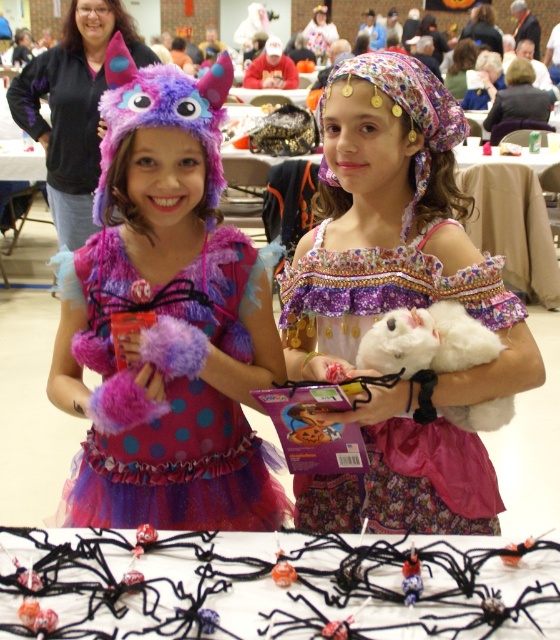
Does point (286, 550) come farther from viewer compared to point (96, 147)?

No, (286, 550) is closer to viewer.

Who is taller, black fabric spider web at lower center or fuzzy purple monster hat at left?

fuzzy purple monster hat at left

Which is behind, point (81, 531) or point (87, 141)?

The point (87, 141) is more distant.

In order to click on black fabric spider web at lower center in this screenshot , I will do `click(274, 586)`.

Is point (494, 524) behind point (440, 314)?

Yes, it is behind point (440, 314).

Find the location of a particular element. The width and height of the screenshot is (560, 640). floral satin dress at center is located at coordinates (407, 483).

Is point (88, 540) in front of point (351, 330)?

Yes, it is in front of point (351, 330).

Between black fabric spider web at lower center and floral satin dress at center, which one is positioned higher?

floral satin dress at center

What are the coordinates of `black fabric spider web at lower center` in the screenshot? It's located at (274, 586).